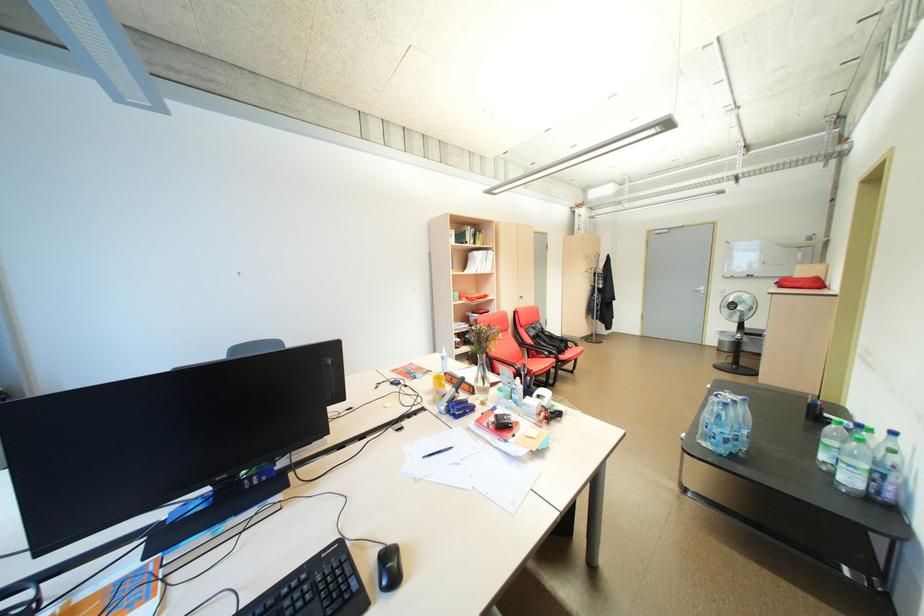
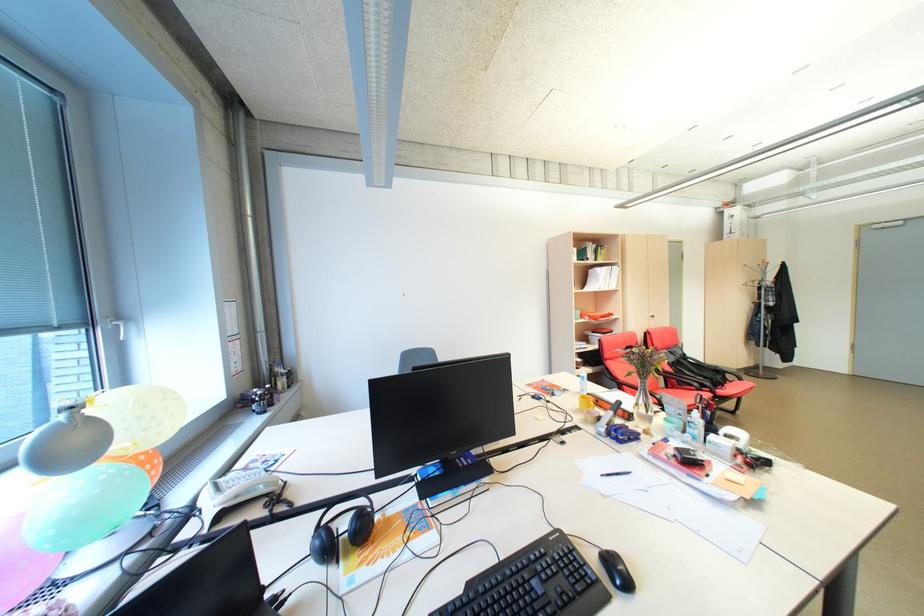
Find the pixel in the second image that matches [537,398] in the first image.

(722, 436)